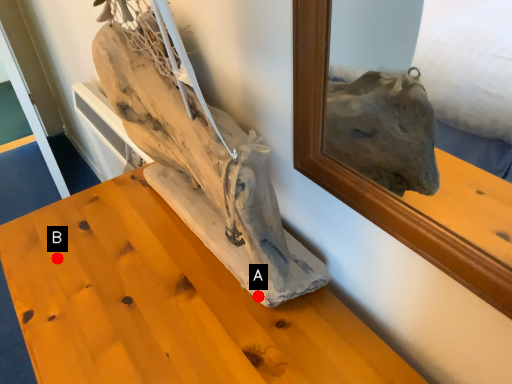
Question: Two points are circled on the image, labeled by A and B beside each circle. Which point is farther to the camera?

Choices:
 (A) A is further
 (B) B is further

Answer: (B)